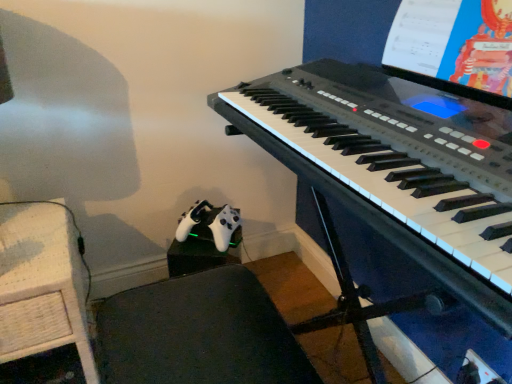
Question: Is black plastic keyboard at center inside the boundaries of white paper at upper right, or outside?

Choices:
 (A) outside
 (B) inside

Answer: (A)

Question: From their relative heights in the image, would you say black plastic keyboard at center is taller or shorter than white paper at upper right?

Choices:
 (A) short
 (B) tall

Answer: (A)

Question: Based on their relative distances, which object is nearer to the black plastic keyboard at center?

Choices:
 (A) woven wood table at lower left
 (B) white paper at upper right

Answer: (B)

Question: Which object is the closest to the woven wood table at lower left?

Choices:
 (A) white paper at upper right
 (B) black plastic keyboard at center

Answer: (B)